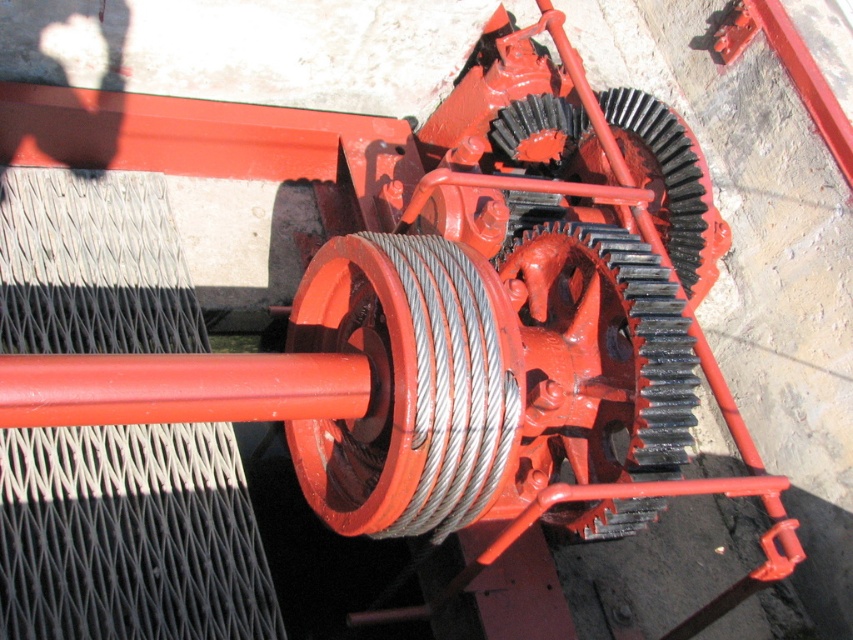
You are an engineer inspecting the mechanical device. You notice a point at coordinates (407, 385). What object is located at that point?

The point at coordinates (407, 385) corresponds to the matte orange pulley at center.

From the picture: You are an engineer inspecting the mechanical device. You notice the matte orange pulley at center and the metallic wire at center. Which object has a greater width?

The matte orange pulley at center has a greater width than the metallic wire at center.

You are an engineer examining the mechanical device. You notice the matte orange pulley at center and the metallic wire at center. Which object is positioned in front of the other?

The matte orange pulley at center is closer to the viewer than the metallic wire at center, so it is positioned in front of the metallic wire at center.